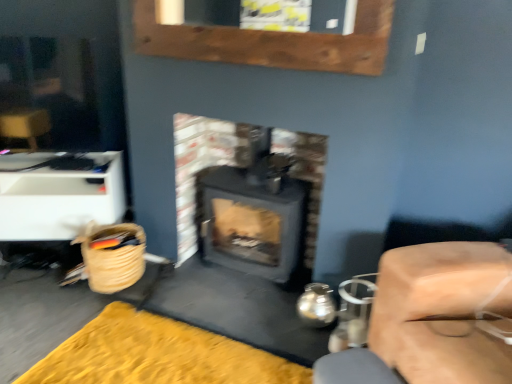
The image size is (512, 384). What are the coordinates of `vacant region in front of matte black wood burning stove at center` in the screenshot? It's located at (245, 311).